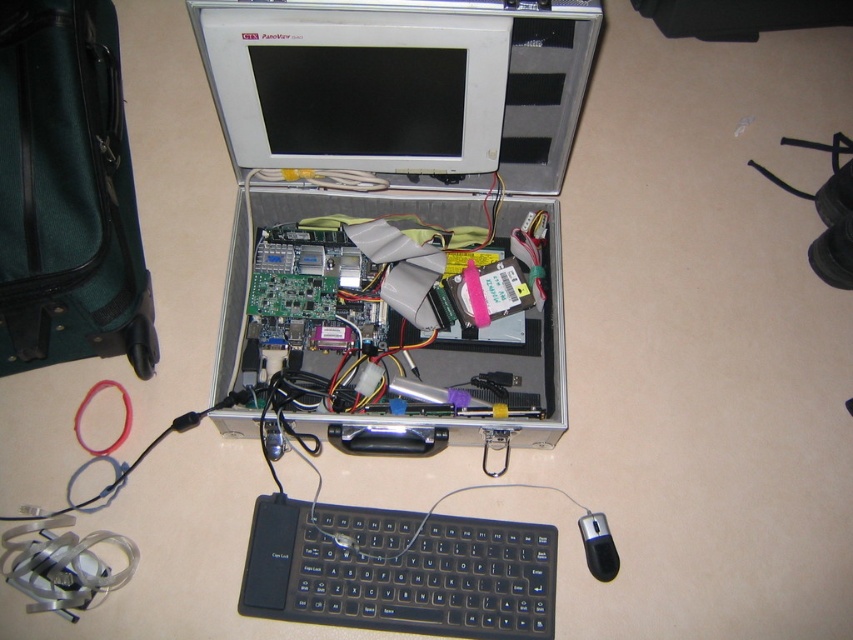
Consider the image. Who is lower down, silver metallic computer at center or black plastic mouse at lower right?

black plastic mouse at lower right is lower down.

Is silver metallic computer at center to the left of black plastic mouse at lower right from the viewer's perspective?

Yes, silver metallic computer at center is to the left of black plastic mouse at lower right.

Find the location of `silver metallic computer at center`. silver metallic computer at center is located at coordinates (398, 204).

Is silver metallic computer at center to the right of black plastic keyboard at lower center from the viewer's perspective?

No, silver metallic computer at center is not to the right of black plastic keyboard at lower center.

Which of these two, silver metallic computer at center or black plastic keyboard at lower center, stands shorter?

With less height is black plastic keyboard at lower center.

Is point (343, 257) farther from viewer compared to point (500, 534)?

Yes, point (343, 257) is farther from viewer.

At what (x,y) coordinates should I click in order to perform the action: click on silver metallic computer at center. Please return your answer as a coordinate pair (x, y). This screenshot has height=640, width=853. Looking at the image, I should click on (398, 204).

Is black plastic keyboard at lower center taller than black plastic mouse at lower right?

Correct, black plastic keyboard at lower center is much taller as black plastic mouse at lower right.

Between point (421, 548) and point (605, 573), which one is positioned behind?

The point (605, 573) is behind.

Locate an element on the screen. The image size is (853, 640). black plastic keyboard at lower center is located at coordinates (403, 577).